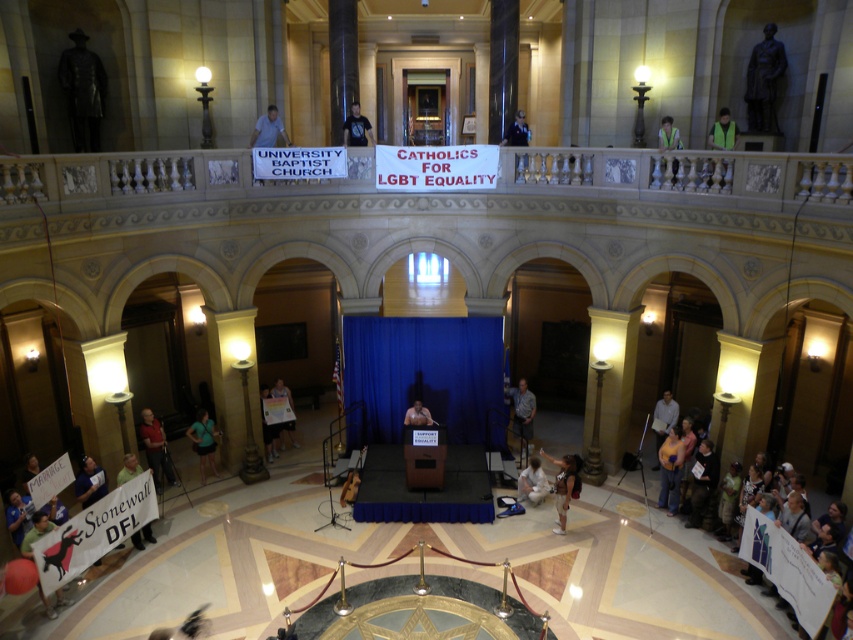
Question: Is bronze statue at upper right behind light brown wooden podium at center?

Choices:
 (A) no
 (B) yes

Answer: (A)

Question: Which is farther from the yellow reflective vest at upper right?

Choices:
 (A) dark blue t-shirt at upper center
 (B) reflective safety vest at upper right
 (C) white paper at center
 (D) light brown leather jacket at lower right

Answer: (C)

Question: Can you confirm if blue t-shirt at lower left is thinner than reflective safety vest at upper right?

Choices:
 (A) no
 (B) yes

Answer: (B)

Question: Considering the real-world distances, which object is farthest from the white paper sign at lower left?

Choices:
 (A) red shirt at lower left
 (B) light brown leather jacket at lower right
 (C) dark blue t-shirt at upper center

Answer: (B)

Question: Which point is closer to the camera?

Choices:
 (A) (283, 136)
 (B) (546, 492)

Answer: (B)

Question: Does bronze statue at upper right appear over light brown wooden podium at center?

Choices:
 (A) no
 (B) yes

Answer: (B)